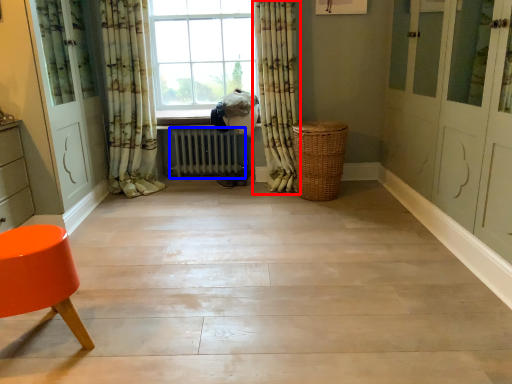
Question: Which object is further to the camera taking this photo, curtain (highlighted by a red box) or radiator (highlighted by a blue box)?

Choices:
 (A) curtain
 (B) radiator

Answer: (B)